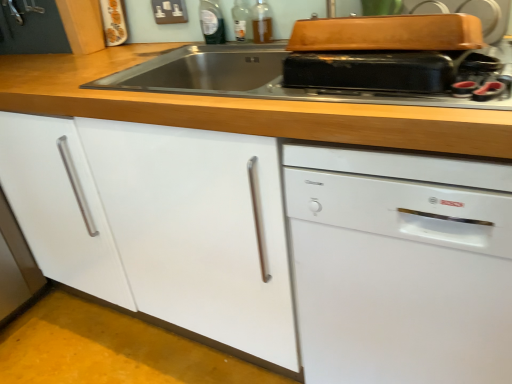
Question: Is translucent glass bottle at upper center, which is the 1th bottle in right-to-left order, shorter than wooden at upper center?

Choices:
 (A) yes
 (B) no

Answer: (A)

Question: Is translucent glass bottle at upper center, acting as the 3th bottle starting from the left, far from wooden at upper center?

Choices:
 (A) yes
 (B) no

Answer: (B)

Question: Is translucent glass bottle at upper center, acting as the 3th bottle starting from the left, directly adjacent to wooden at upper center?

Choices:
 (A) no
 (B) yes

Answer: (A)

Question: From the image's perspective, is translucent glass bottle at upper center, acting as the 3th bottle starting from the left, on top of wooden at upper center?

Choices:
 (A) yes
 (B) no

Answer: (A)

Question: Is the depth of translucent glass bottle at upper center, acting as the 3th bottle starting from the left, greater than that of wooden at upper center?

Choices:
 (A) no
 (B) yes

Answer: (B)

Question: From a real-world perspective, does translucent glass bottle at upper center, which is the 1th bottle in right-to-left order, sit lower than wooden at upper center?

Choices:
 (A) yes
 (B) no

Answer: (B)

Question: From a real-world perspective, is white matte cabinet at center located higher than matte black toaster at upper center?

Choices:
 (A) yes
 (B) no

Answer: (B)

Question: Is white matte cabinet at center to the right of matte black toaster at upper center from the viewer's perspective?

Choices:
 (A) yes
 (B) no

Answer: (B)

Question: Considering the relative sizes of white matte cabinet at center and matte black toaster at upper center in the image provided, is white matte cabinet at center smaller than matte black toaster at upper center?

Choices:
 (A) no
 (B) yes

Answer: (A)

Question: Is white matte cabinet at center touching matte black toaster at upper center?

Choices:
 (A) no
 (B) yes

Answer: (A)

Question: Considering the relative sizes of white matte cabinet at center and matte black toaster at upper center in the image provided, is white matte cabinet at center thinner than matte black toaster at upper center?

Choices:
 (A) no
 (B) yes

Answer: (A)

Question: From the image's perspective, is white matte cabinet at center under matte black toaster at upper center?

Choices:
 (A) yes
 (B) no

Answer: (A)

Question: Can we say wooden at upper center lies outside translucent glass bottle at upper center, acting as the 3th bottle starting from the left?

Choices:
 (A) no
 (B) yes

Answer: (B)